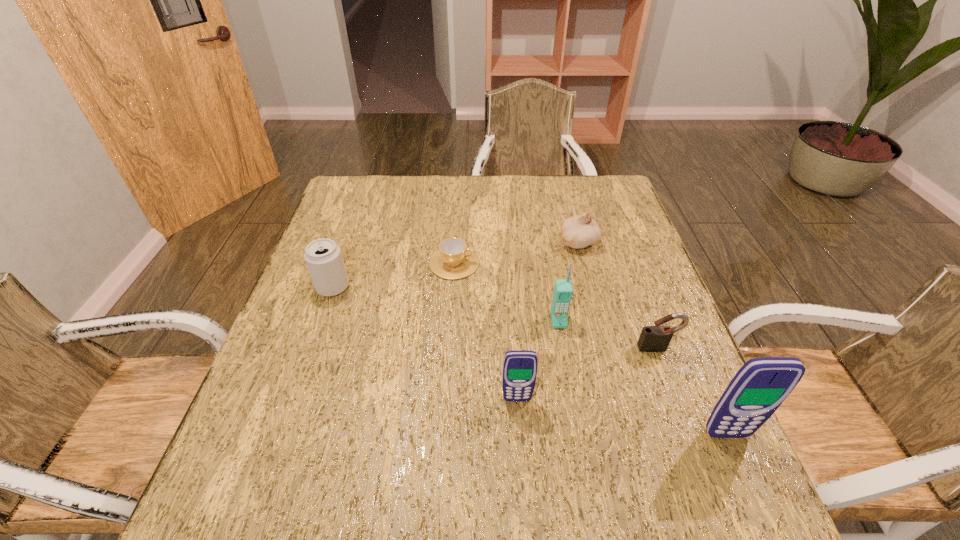
The width and height of the screenshot is (960, 540). I want to click on cellular telephone at the right edge, so click(761, 385).

Locate an element on the screen. The width and height of the screenshot is (960, 540). garlic that is at the right edge is located at coordinates (580, 231).

Where is `padlock located at the right edge`? The height and width of the screenshot is (540, 960). padlock located at the right edge is located at coordinates click(656, 338).

Identify the location of object located in the near right corner section of the desktop. (761, 385).

Image resolution: width=960 pixels, height=540 pixels. I want to click on free region at the far edge of the desktop, so click(468, 176).

Identify the location of free space at the near edge. The image size is (960, 540). (516, 425).

Identify the location of vacant space at the left edge of the desktop. (363, 258).

This screenshot has height=540, width=960. I want to click on free space at the right edge, so click(632, 237).

In the image, there is a desktop. Where is `vacant space at the far left corner`? Image resolution: width=960 pixels, height=540 pixels. vacant space at the far left corner is located at coordinates (339, 195).

This screenshot has height=540, width=960. Find the location of `free location at the near right corner`. free location at the near right corner is located at coordinates (655, 437).